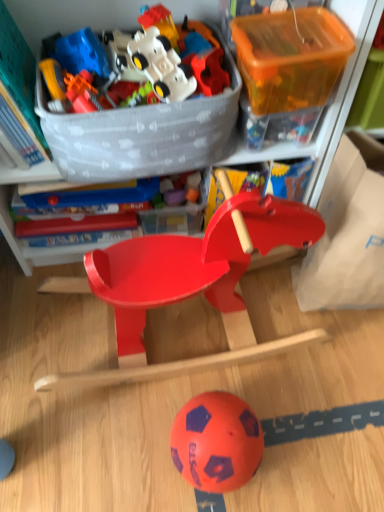
Identify the location of free location in front of matte plastic rocking horse at center. The image size is (384, 512). (167, 426).